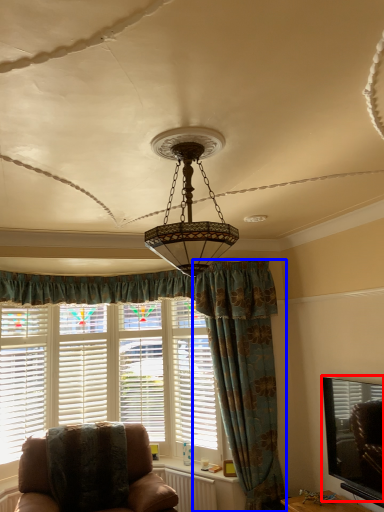
Question: Which object is closer to the camera taking this photo, window screen (highlighted by a red box) or curtain (highlighted by a blue box)?

Choices:
 (A) window screen
 (B) curtain

Answer: (A)